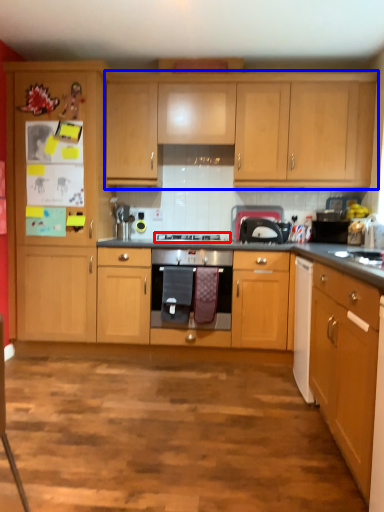
Question: Which object appears farthest to the camera in this image, gas stove (highlighted by a red box) or cabinetry (highlighted by a blue box)?

Choices:
 (A) gas stove
 (B) cabinetry

Answer: (B)